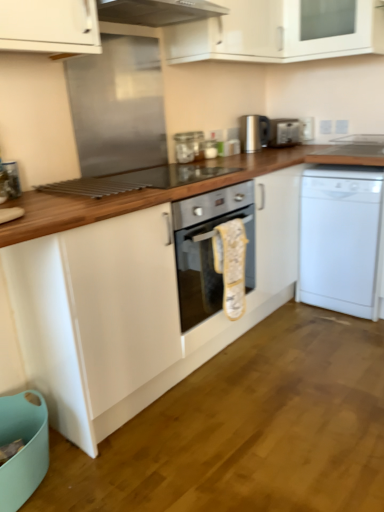
You are a GUI agent. You are given a task and a screenshot of the screen. Output one action in this format:
    pyautogui.click(x=<x>, y=<y>)
    Task: Click on the space that is in front of satin silver kettle at upper center, the 2th appliance positioned from the right
    The height and width of the screenshot is (512, 384).
    Given the screenshot: What is the action you would take?
    pyautogui.click(x=257, y=155)